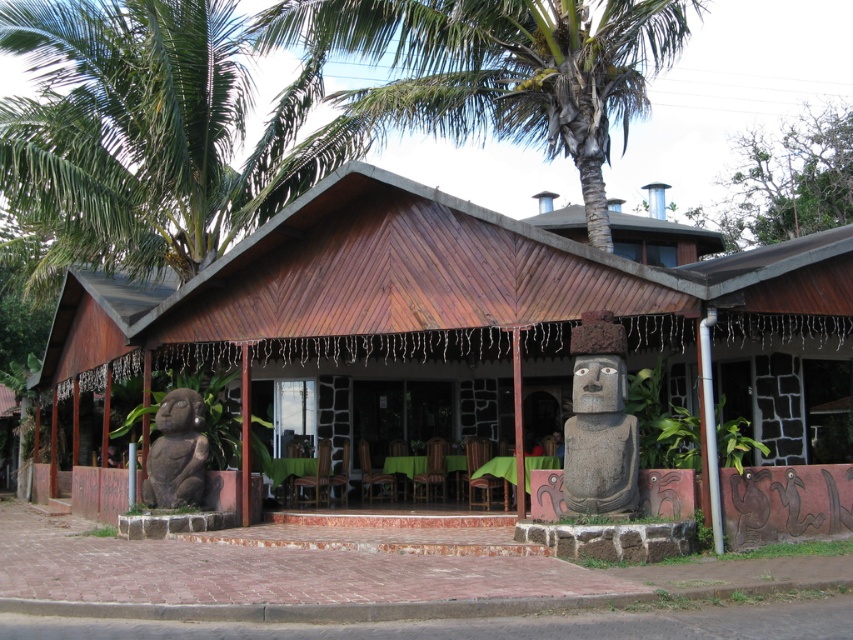
You are standing at the entrance of the rustic building and want to place two decorative lights at the coordinates point (544,16) and point (706,449). Which point is closer to the entrance?

Point (706,449) is closer to the entrance because it is in front of point (544,16), which is further away.

You are standing in front of the rustic building and notice a green leafy palm tree at upper center and a silver metallic pipe at right. Which object is positioned more to the right side of the scene?

The silver metallic pipe at right is positioned more to the right side of the scene because the green leafy palm tree at upper center is to the right of it, meaning the pipe is further to the right.